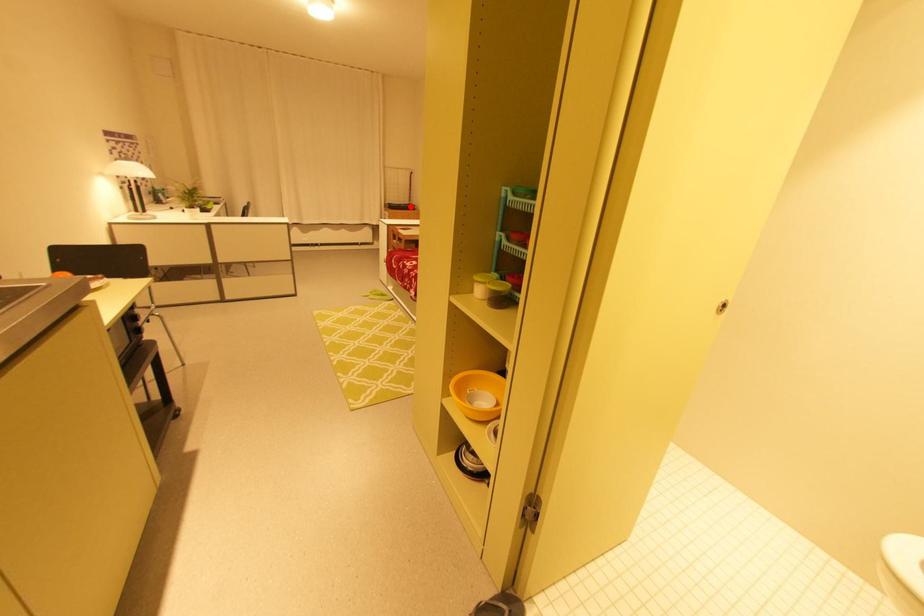
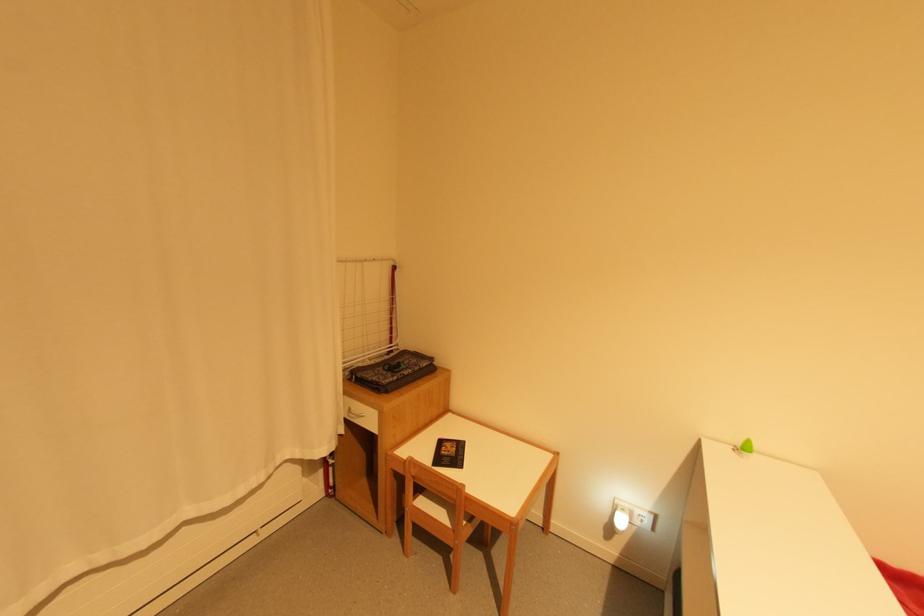
In the second image, find the point that corresponds to the highlighted location in the first image.

(421, 369)